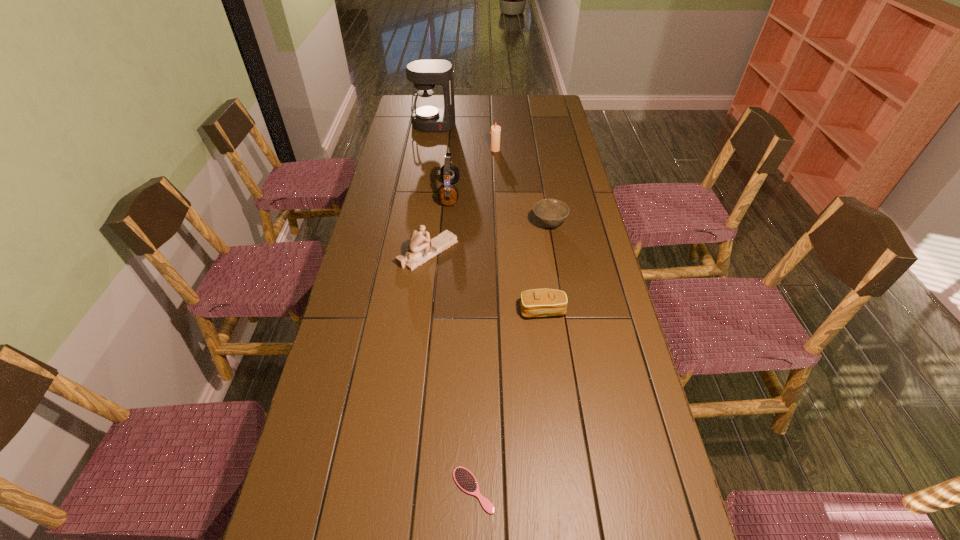
Where is `the shortest object`? This screenshot has height=540, width=960. the shortest object is located at coordinates (465, 480).

At what (x,y) coordinates should I click in order to perform the action: click on free space located on the button side of the farthest object. Please return your answer as a coordinate pair (x, y). This screenshot has height=540, width=960. Looking at the image, I should click on (430, 146).

Locate an element on the screen. vacant space located 0.370m on the ear cups of the second tallest object is located at coordinates (551, 194).

The image size is (960, 540). In order to click on free space located on the front of the candle in this screenshot , I will do `click(497, 200)`.

Find the location of a particular element. The width and height of the screenshot is (960, 540). vacant region located on the front-facing side of the figurine is located at coordinates coord(472,252).

Where is `vacant space located on the right of the bowl`? The height and width of the screenshot is (540, 960). vacant space located on the right of the bowl is located at coordinates (586, 225).

The image size is (960, 540). In order to click on vacant space positioned on the zipper side of the clutch bag in this screenshot , I will do `click(546, 338)`.

The image size is (960, 540). Find the location of `vacant space located 0.140m on the left of the hairbrush`. vacant space located 0.140m on the left of the hairbrush is located at coordinates (391, 490).

Locate an element on the screen. This screenshot has height=540, width=960. coffee maker located at the left edge is located at coordinates (424, 74).

Image resolution: width=960 pixels, height=540 pixels. I want to click on figurine that is at the left edge, so click(421, 249).